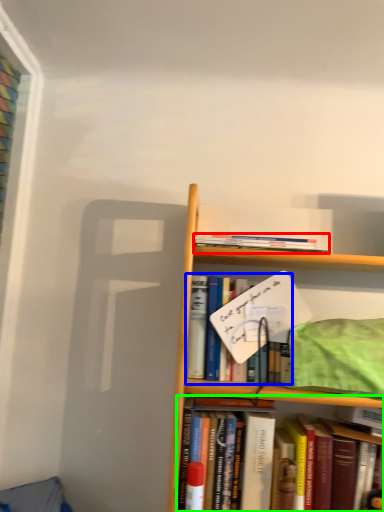
Question: Considering the real-world distances, which object is closest to book (highlighted by a red box)? book (highlighted by a blue box) or book (highlighted by a green box).

Choices:
 (A) book
 (B) book

Answer: (A)